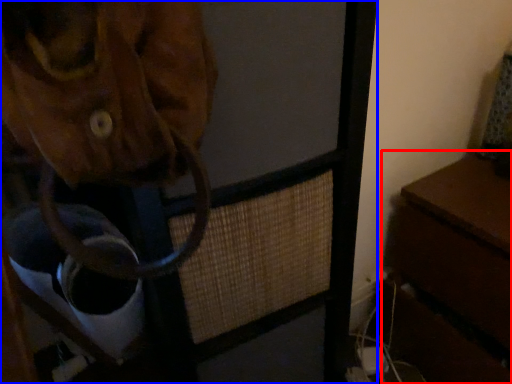
Question: Among these objects, which one is farthest to the camera, table (highlighted by a red box) or furniture (highlighted by a blue box)?

Choices:
 (A) table
 (B) furniture

Answer: (A)